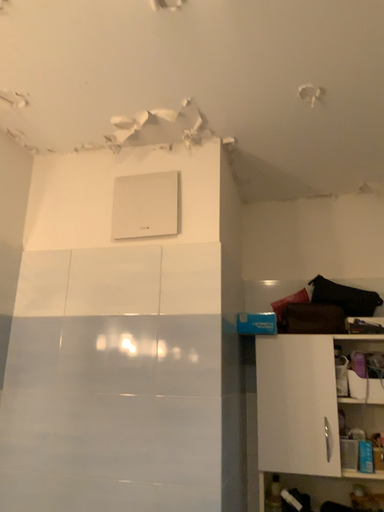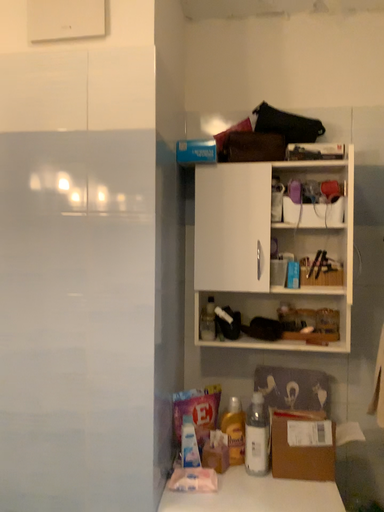
Question: Which way did the camera rotate in the video?

Choices:
 (A) rotated downward
 (B) rotated upward

Answer: (A)